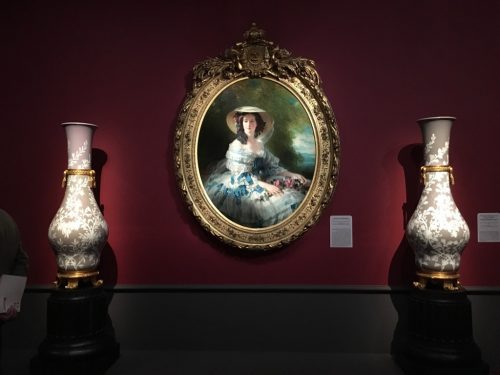
Detect presence of where you'd put flowers in the image and mark them. Your answer should be formatted as a list of tuples, i.e. [(x1, y1), (x2, y2), ...], where each tuple contains the x and y coordinates of a point satisfying the conditions above.

[(439, 117), (79, 123)]